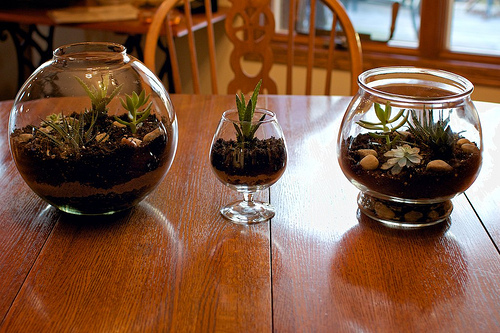
This screenshot has height=333, width=500. What are the coordinates of `chair spindles` in the screenshot? It's located at (170, 47), (190, 53), (211, 47), (288, 45), (308, 52), (328, 61).